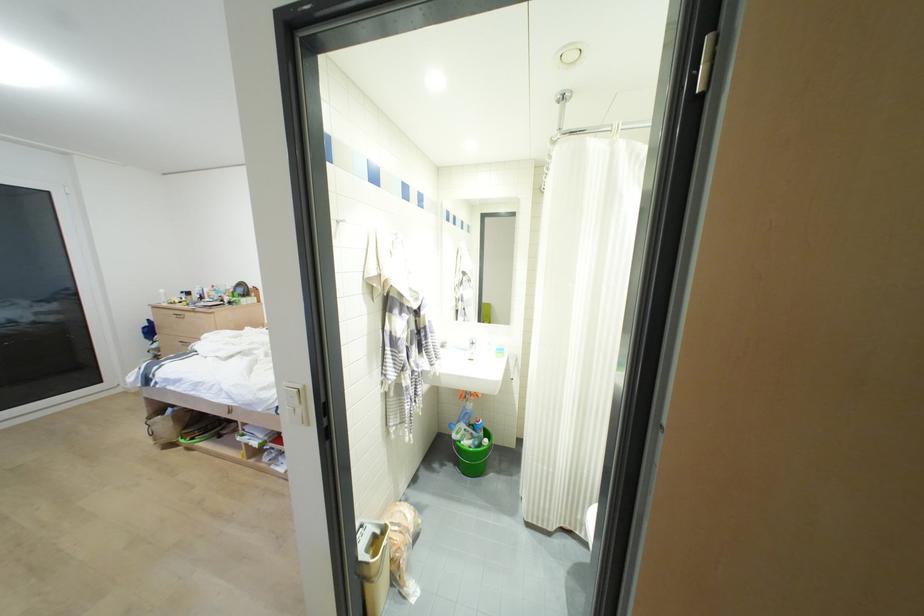
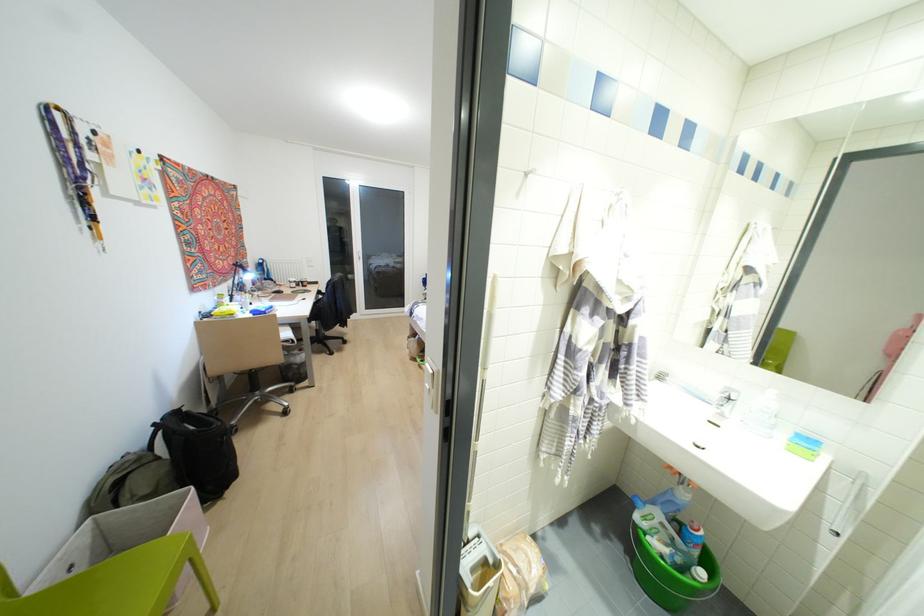
Find the pixel in the second image that matches the point at 304,386 in the first image.

(438, 371)